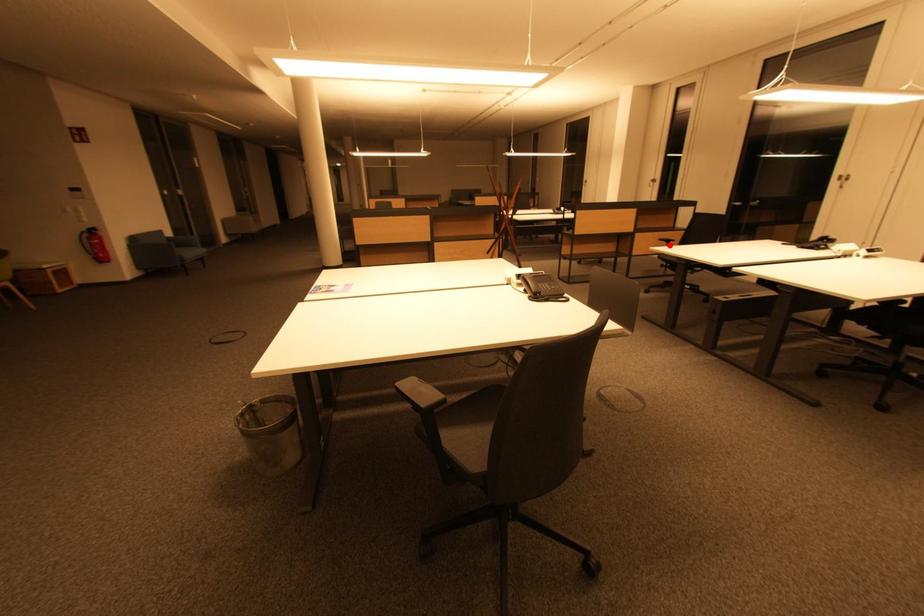
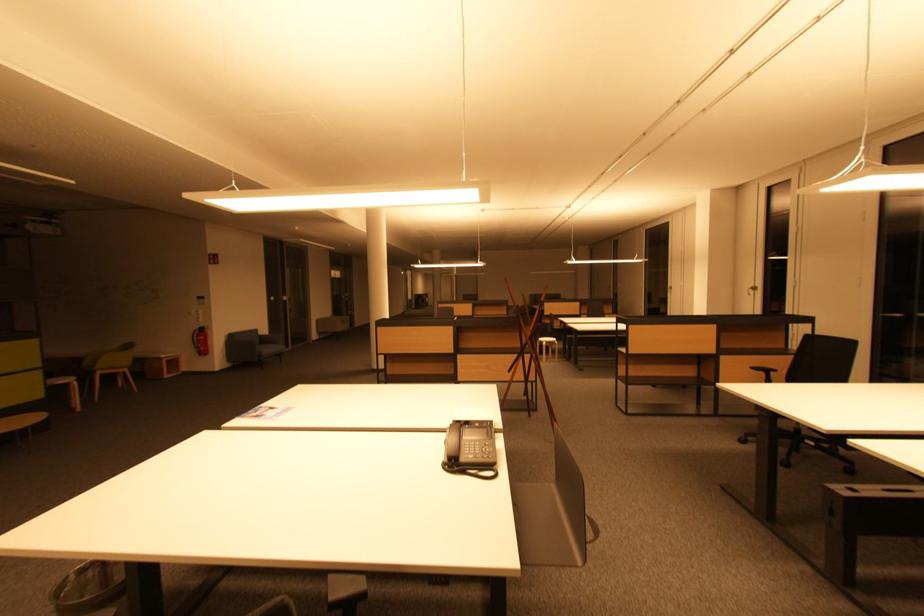
Question: A red point is marked in image1. In image2, is the corresponding 3D point closer to the camera or farther? Reply with the corresponding letter.

Choices:
 (A) The corresponding 3D point is closer.
 (B) The corresponding 3D point is farther.

Answer: (B)